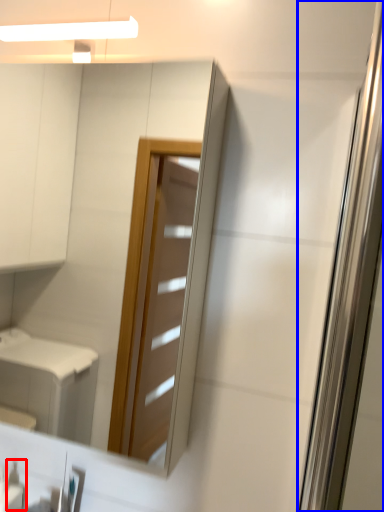
Question: Which of the following is the farthest to the observer, toiletry (highlighted by a red box) or screen door (highlighted by a blue box)?

Choices:
 (A) toiletry
 (B) screen door

Answer: (A)